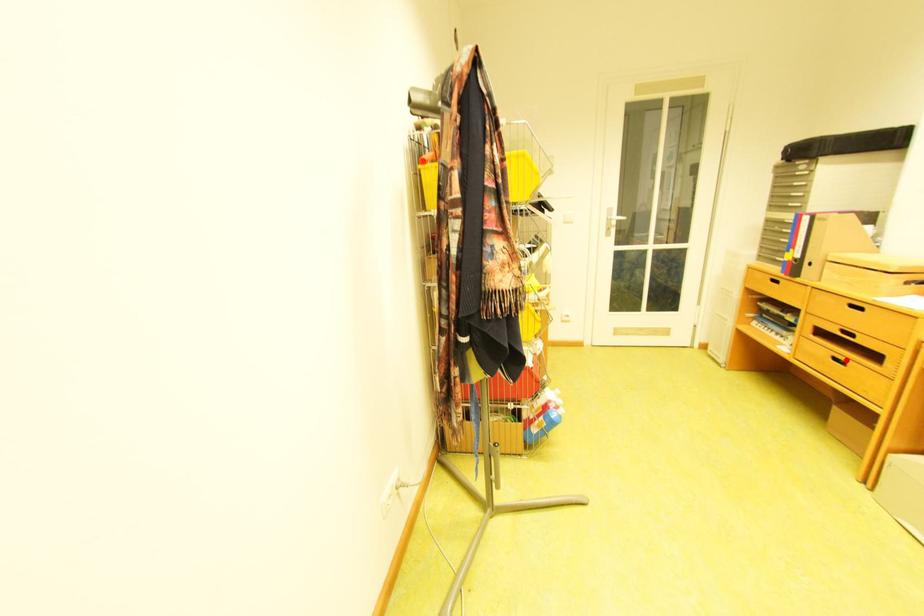
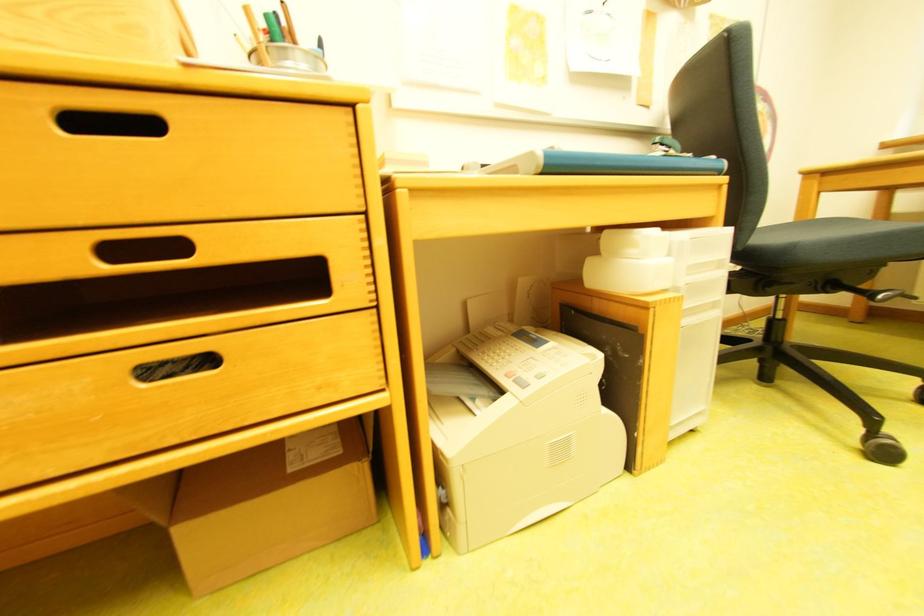
Question: A red point is marked in image1. In image2, is the corresponding 3D point closer to the camera or farther? Reply with the corresponding letter.

Choices:
 (A) The corresponding 3D point is closer.
 (B) The corresponding 3D point is farther.

Answer: (A)